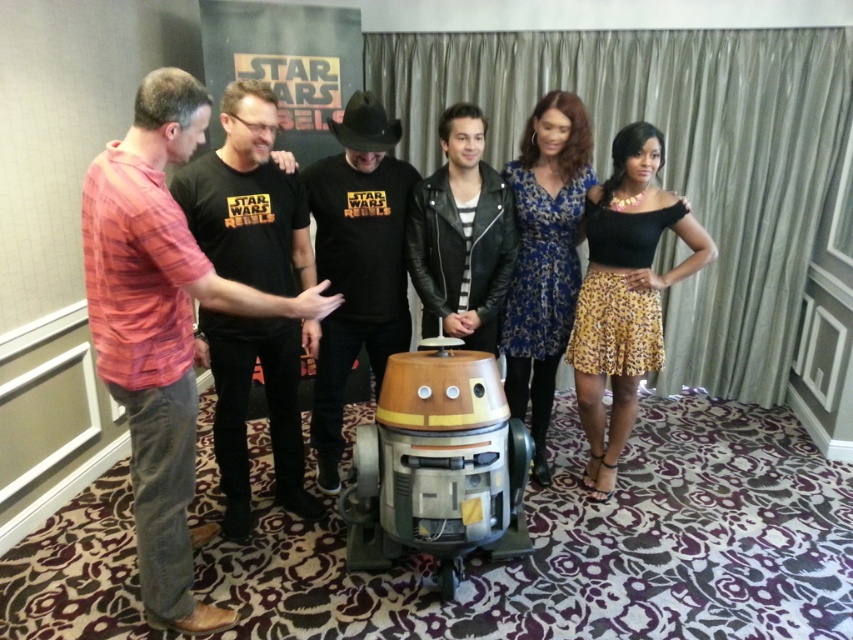
Which is below, red plaid shirt at left or blue floral dress at center?

Positioned lower is red plaid shirt at left.

Which is behind, point (152, 467) or point (529, 272)?

The point (529, 272) is more distant.

The width and height of the screenshot is (853, 640). I want to click on red plaid shirt at left, so click(x=161, y=330).

Is point (602, 449) more distant than point (543, 282)?

That is True.

Is the position of black leopard print skirt at right less distant than that of blue floral dress at center?

Yes, black leopard print skirt at right is in front of blue floral dress at center.

Describe the element at coordinates (624, 292) in the screenshot. I see `black leopard print skirt at right` at that location.

You are a GUI agent. You are given a task and a screenshot of the screen. Output one action in this format:
    pyautogui.click(x=<x>, y=<y>)
    Task: Click on the black leopard print skirt at right
    Image resolution: width=853 pixels, height=640 pixels.
    Given the screenshot: What is the action you would take?
    pyautogui.click(x=624, y=292)

Is red plaid shirt at left behind leather jacket at center?

No, it is not.

Does red plaid shirt at left come in front of leather jacket at center?

Yes, it is in front of leather jacket at center.

Is point (138, 497) positioned after point (495, 312)?

No, (138, 497) is closer to viewer.

The width and height of the screenshot is (853, 640). I want to click on red plaid shirt at left, so click(161, 330).